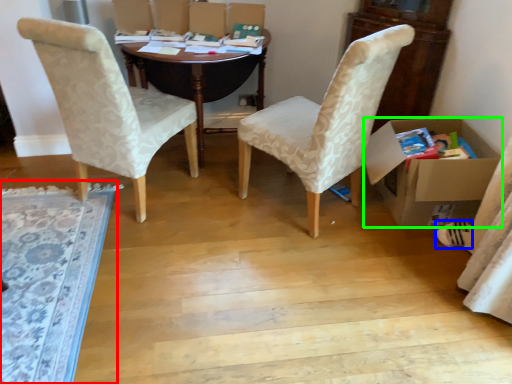
Question: Which object is positioned farthest from mat (highlighted by a red box)? Select from footwear (highlighted by a blue box) and box (highlighted by a green box).

Choices:
 (A) footwear
 (B) box

Answer: (A)